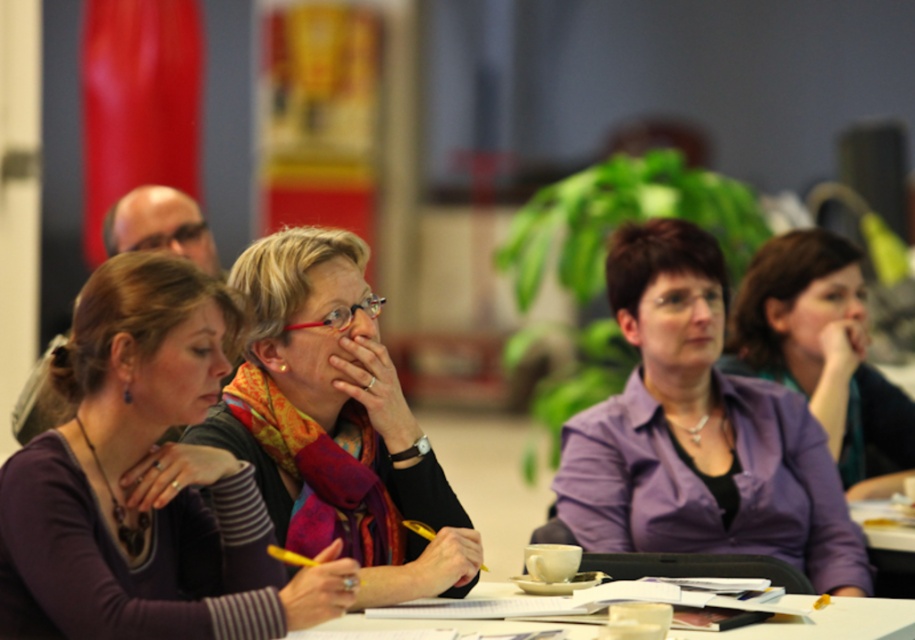
Question: Is matte purple shirt at center below matte black scarf at center?

Choices:
 (A) no
 (B) yes

Answer: (B)

Question: Which object is positioned farthest from the purple shirt at center?

Choices:
 (A) matte black scarf at center
 (B) white paper at center
 (C) matte purple shirt at center
 (D) purple matte shirt at center

Answer: (C)

Question: Is matte black scarf at center positioned before purple matte shirt at center?

Choices:
 (A) no
 (B) yes

Answer: (B)

Question: Among these points, which one is nearest to the camera?

Choices:
 (A) (375, 621)
 (B) (705, 305)

Answer: (A)

Question: Considering the real-world distances, which object is closest to the white paper at center?

Choices:
 (A) purple shirt at center
 (B) purple matte shirt at center
 (C) matte black scarf at center
 (D) matte purple shirt at center

Answer: (C)

Question: Does matte purple shirt at center appear under white paper at center?

Choices:
 (A) yes
 (B) no

Answer: (B)